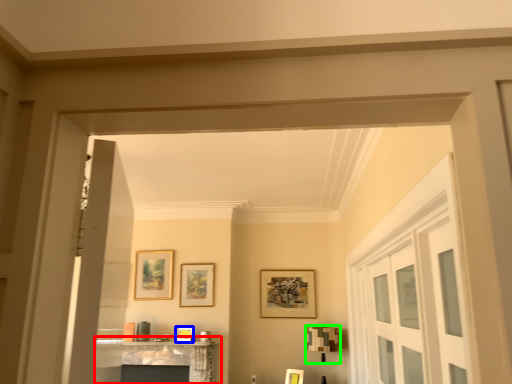
Question: Which object is the closest to the table (highlighted by a red box)? Choose among these: picture frame (highlighted by a blue box) or lamp (highlighted by a green box).

Choices:
 (A) picture frame
 (B) lamp

Answer: (A)